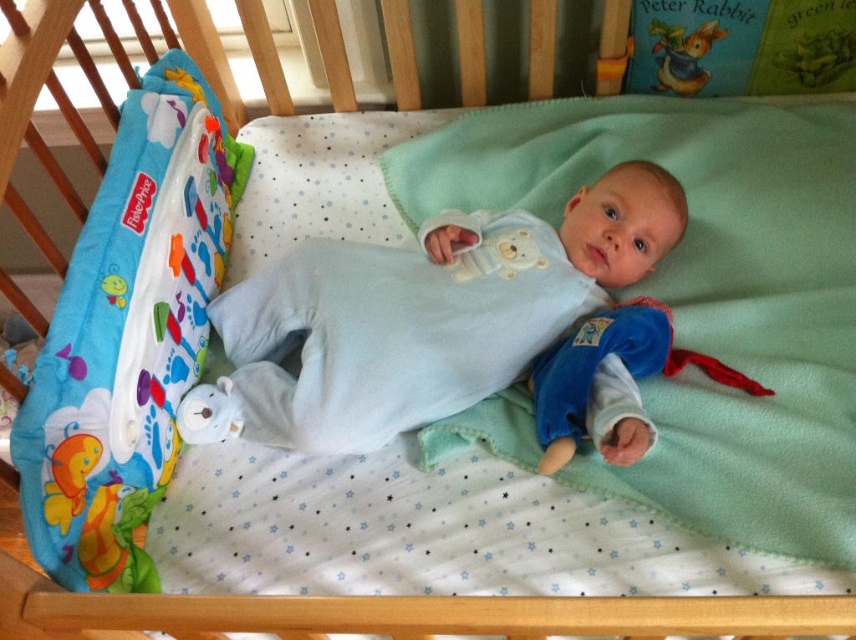
Who is taller, green fleece blanket at center or light blue fleece onesie at center?

Standing taller between the two is green fleece blanket at center.

Is the position of green fleece blanket at center less distant than that of light blue fleece onesie at center?

Yes, green fleece blanket at center is closer to the viewer.

Identify the location of green fleece blanket at center. (704, 292).

Is the position of green fleece blanket at center less distant than that of rubber teething ring at lower right?

That is True.

The height and width of the screenshot is (640, 856). In order to click on green fleece blanket at center in this screenshot , I will do `click(704, 292)`.

Is the position of light blue fleece onesie at center more distant than that of rubber teething ring at lower right?

Yes, light blue fleece onesie at center is behind rubber teething ring at lower right.

Does light blue fleece onesie at center appear on the right side of rubber teething ring at lower right?

In fact, light blue fleece onesie at center is to the left of rubber teething ring at lower right.

This screenshot has width=856, height=640. What do you see at coordinates (421, 316) in the screenshot?
I see `light blue fleece onesie at center` at bounding box center [421, 316].

Where is `light blue fleece onesie at center`? This screenshot has height=640, width=856. light blue fleece onesie at center is located at coordinates (421, 316).